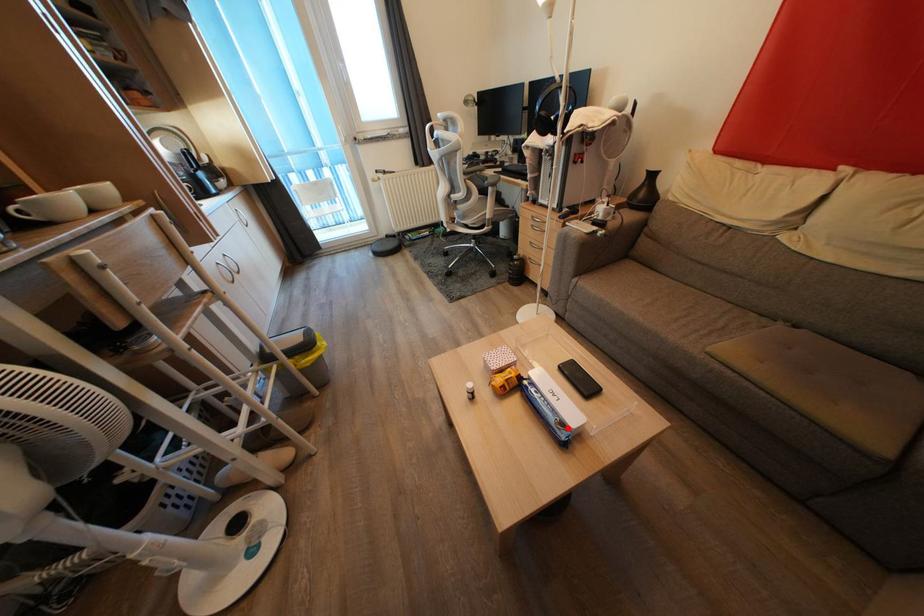
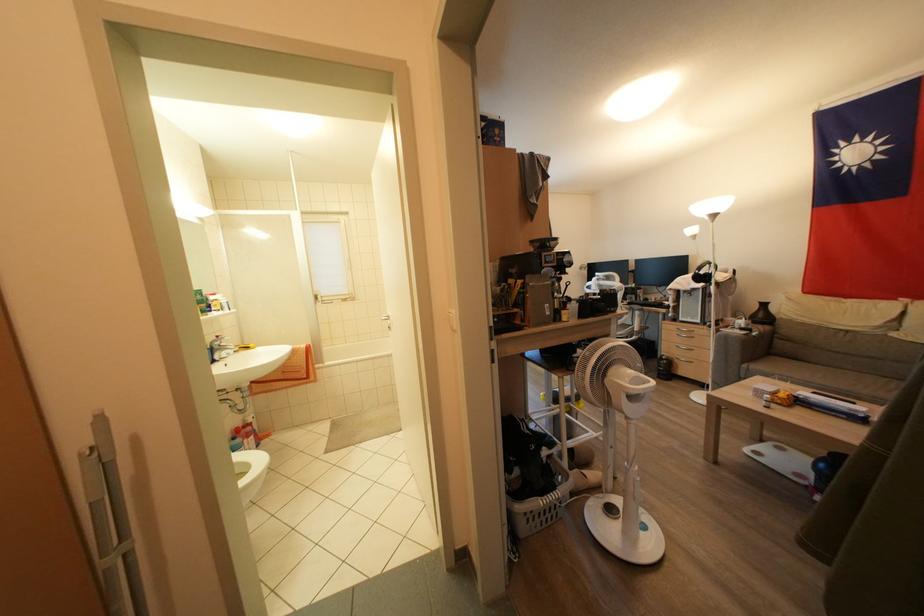
Find the pixel in the second image that matches the highlighted location in the first image.

(858, 415)